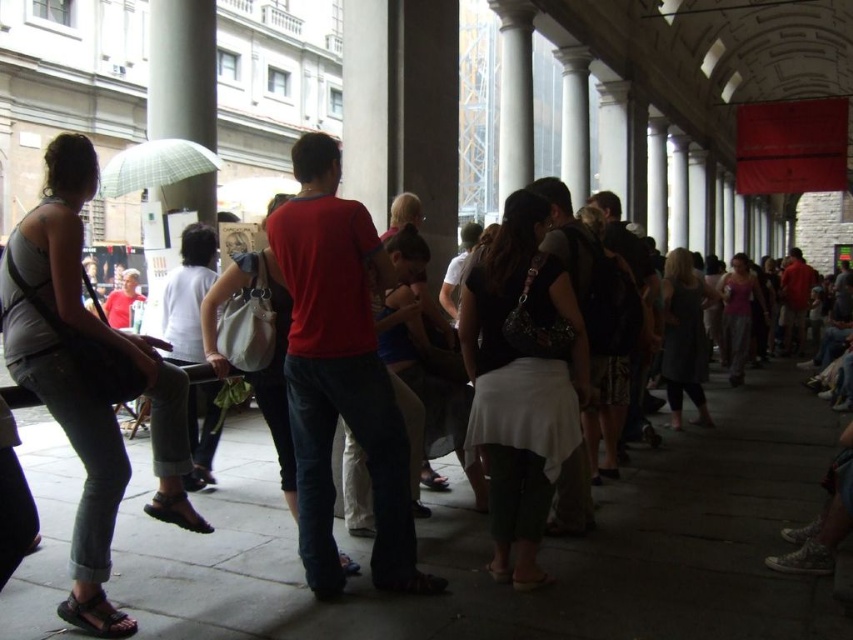
Can you confirm if denim jeans at left is positioned below dark gray dress at center?

Incorrect, denim jeans at left is not positioned below dark gray dress at center.

Does denim jeans at left come in front of dark gray dress at center?

Yes, denim jeans at left is in front of dark gray dress at center.

Who is more forward, (55, 200) or (688, 276)?

Point (55, 200) is more forward.

Where is `denim jeans at left`? The image size is (853, 640). denim jeans at left is located at coordinates (88, 380).

Who is higher up, denim jeans at left or pink fabric tank top at center?

denim jeans at left is higher up.

Is denim jeans at left to the right of pink fabric tank top at center from the viewer's perspective?

In fact, denim jeans at left is to the left of pink fabric tank top at center.

Is point (91, 497) positioned behind point (743, 332)?

No, it is not.

Identify the location of denim jeans at left. This screenshot has height=640, width=853. (88, 380).

Who is more distant from viewer, (578, 356) or (161, 140)?

Point (161, 140)

Is black textured skirt at center to the left of plaid fabric umbrella at upper left from the viewer's perspective?

No, black textured skirt at center is not to the left of plaid fabric umbrella at upper left.

Does point (558, 280) come farther from viewer compared to point (198, 157)?

No, (558, 280) is in front of (198, 157).

Where is `black textured skirt at center`? This screenshot has width=853, height=640. black textured skirt at center is located at coordinates (520, 384).